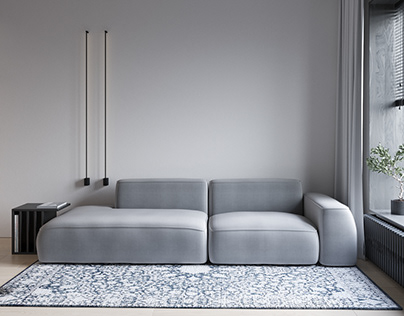
The image size is (404, 316). I want to click on sofa, so click(x=190, y=219).